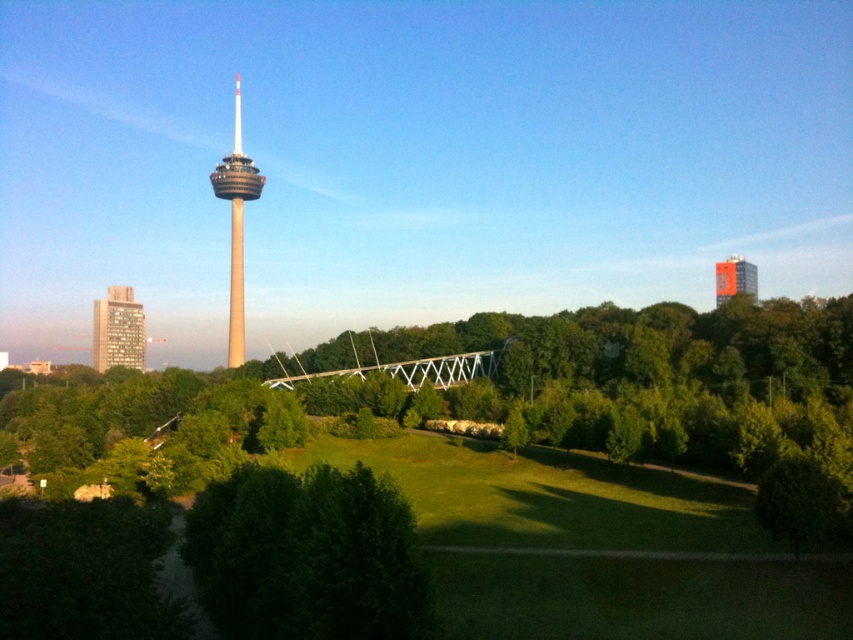
Question: Estimate the real-world distances between objects in this image. Which object is closer to the green leafy tree at lower left?

Choices:
 (A) orange matte building at upper right
 (B) beige concrete tower at center-left

Answer: (B)

Question: Which of the following is the farthest from the observer?

Choices:
 (A) beige concrete tower at center-left
 (B) matte brown building at left
 (C) green leafy tree at lower center
 (D) green leafy tree at lower left

Answer: (B)

Question: Which object is closer to the camera taking this photo?

Choices:
 (A) matte brown building at left
 (B) green leafy tree at lower center

Answer: (B)

Question: Is beige concrete tower at center-left wider than orange matte building at upper right?

Choices:
 (A) yes
 (B) no

Answer: (B)

Question: In this image, where is green leafy tree at lower left located relative to orange matte building at upper right?

Choices:
 (A) below
 (B) above

Answer: (A)

Question: Is beige concrete tower at center-left below matte brown building at left?

Choices:
 (A) yes
 (B) no

Answer: (B)